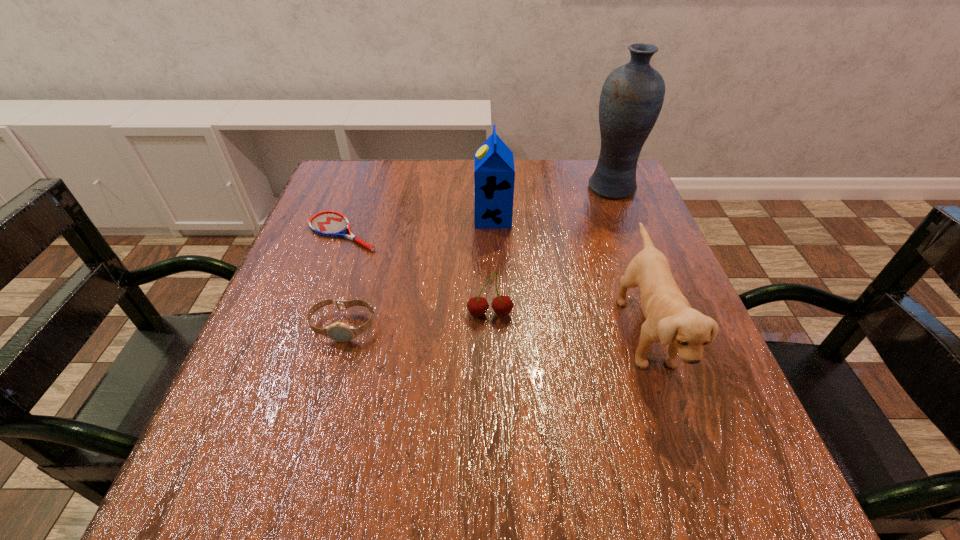
Image resolution: width=960 pixels, height=540 pixels. What are the coordinates of `vacant area located with the cap open on the carton` in the screenshot? It's located at (415, 218).

Where is `vacant space located on the left side of the third tallest object`? The height and width of the screenshot is (540, 960). vacant space located on the left side of the third tallest object is located at coordinates (420, 332).

Locate an element on the screen. This screenshot has height=540, width=960. free region located on the left side of the third tallest object is located at coordinates pos(443,332).

Where is `vacant area located 0.120m on the left side of the third tallest object`? The width and height of the screenshot is (960, 540). vacant area located 0.120m on the left side of the third tallest object is located at coordinates (555, 332).

At what (x,y) coordinates should I click in order to perform the action: click on blank space located on the surface of the fourth tallest object. Please return your answer as a coordinate pair (x, y). The height and width of the screenshot is (540, 960). Looking at the image, I should click on pos(492,389).

Identify the location of vacant position located on the face of the fifth tallest object. (306, 455).

Locate an element on the screen. The height and width of the screenshot is (540, 960). vacant space located on the right of the shortest object is located at coordinates (455, 233).

Locate an element on the screen. This screenshot has height=540, width=960. vase at the far edge is located at coordinates (632, 96).

Locate an element on the screen. The height and width of the screenshot is (540, 960). carton that is at the far edge is located at coordinates (494, 173).

Where is `watch positioned at the left edge`? Image resolution: width=960 pixels, height=540 pixels. watch positioned at the left edge is located at coordinates (341, 332).